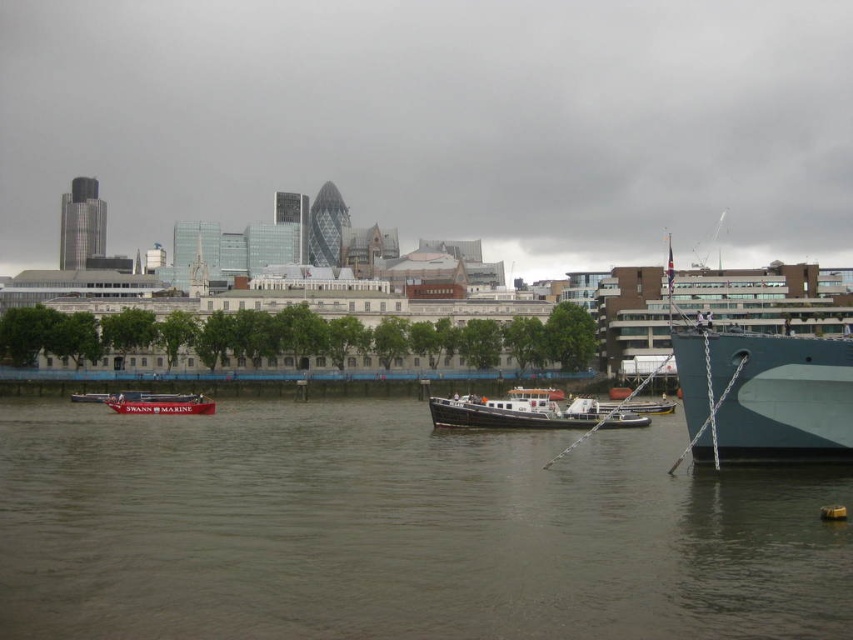
Question: Among these points, which one is farthest from the camera?

Choices:
 (A) (512, 397)
 (B) (729, 419)
 (C) (198, 410)

Answer: (C)

Question: Is teal matte ship at right positioned behind black polished wood boat at center?

Choices:
 (A) no
 (B) yes

Answer: (A)

Question: Estimate the real-world distances between objects in this image. Which object is closer to the brown water at lower center?

Choices:
 (A) teal matte ship at right
 (B) red matte boat at center
 (C) black polished wood boat at center

Answer: (C)

Question: Estimate the real-world distances between objects in this image. Which object is farther from the teal matte ship at right?

Choices:
 (A) red matte boat at center
 (B) brown water at lower center
 (C) black polished wood boat at center

Answer: (A)

Question: Does black polished wood boat at center appear over red matte boat at center?

Choices:
 (A) no
 (B) yes

Answer: (A)

Question: Is brown water at lower center below teal matte ship at right?

Choices:
 (A) yes
 (B) no

Answer: (A)